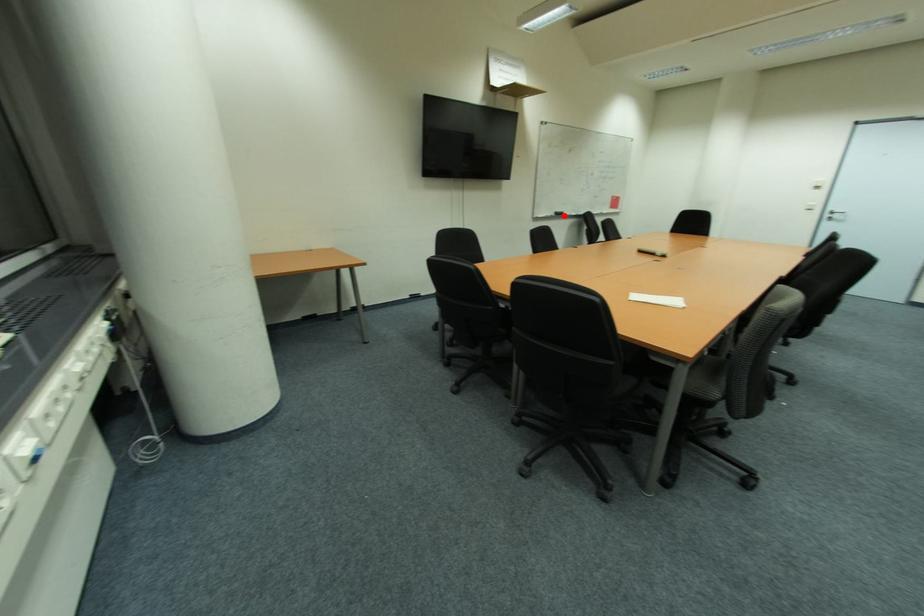
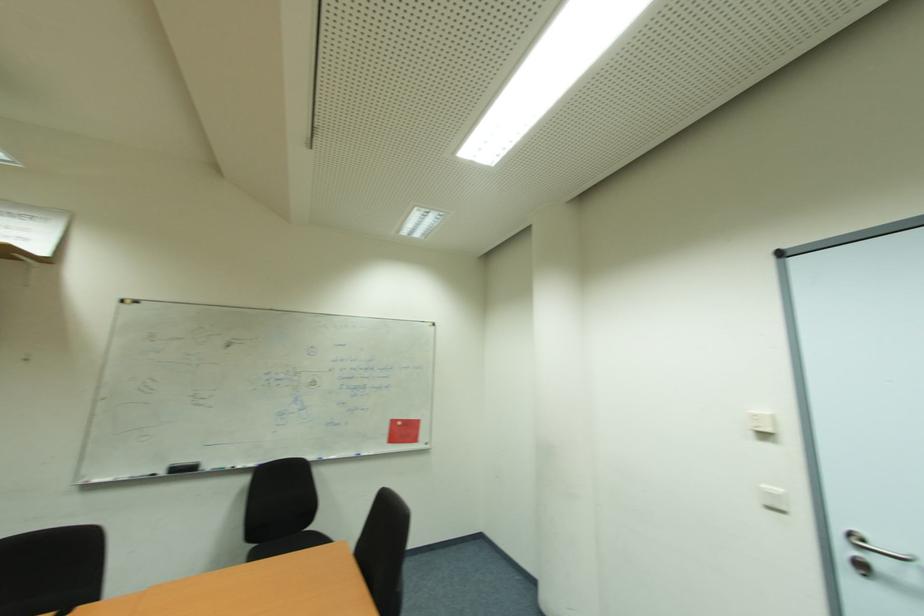
Where in the second image is the point corresponding to the highlighted location from the first image?

(189, 469)